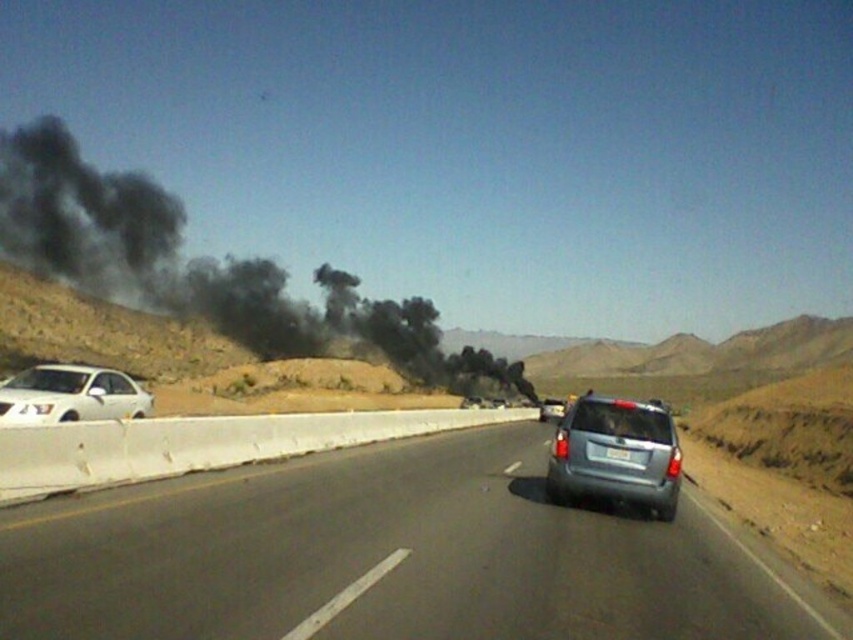
Question: Observing the image, what is the correct spatial positioning of smooth asphalt highway at center in reference to satin silver suv at center?

Choices:
 (A) below
 (B) above

Answer: (A)

Question: Which object is farther from the camera taking this photo?

Choices:
 (A) white plastic license plate at rear
 (B) satin silver suv at center
 (C) smooth asphalt highway at center
 (D) white glossy sedan at left

Answer: (D)

Question: Which is nearer to the satin silver suv at center?

Choices:
 (A) white plastic license plate at rear
 (B) smooth asphalt highway at center

Answer: (A)

Question: Based on their relative distances, which object is farther from the white glossy sedan at left?

Choices:
 (A) satin silver suv at center
 (B) black smoke at left

Answer: (B)

Question: Is smooth asphalt highway at center closer to camera compared to satin silver suv at center?

Choices:
 (A) no
 (B) yes

Answer: (B)

Question: Is black smoke at left wider than white plastic license plate at rear?

Choices:
 (A) yes
 (B) no

Answer: (A)